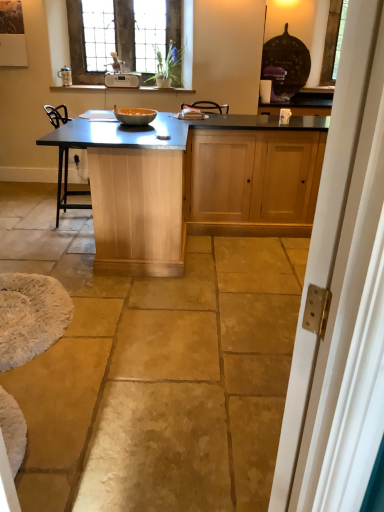
Question: From their relative heights in the image, would you say stained glass window at upper center is taller or shorter than white plastic toaster at upper center?

Choices:
 (A) tall
 (B) short

Answer: (A)

Question: Considering the positions of stained glass window at upper center and white plastic toaster at upper center in the image, is stained glass window at upper center bigger or smaller than white plastic toaster at upper center?

Choices:
 (A) big
 (B) small

Answer: (A)

Question: Which of these objects is positioned farthest from the matte orange bowl at center?

Choices:
 (A) white wood screen door at right
 (B) white fluffy rug at lower left
 (C) white plastic toaster at upper center
 (D) stained glass window at upper center
 (E) matte wood table at center

Answer: (A)

Question: Considering the real-world distances, which object is closest to the white wood screen door at right?

Choices:
 (A) white plastic toaster at upper center
 (B) matte wood table at center
 (C) stained glass window at upper center
 (D) matte orange bowl at center
 (E) white fluffy rug at lower left

Answer: (E)